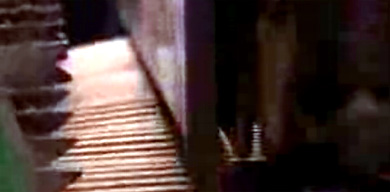
This screenshot has height=192, width=390. Find the location of `top of stair`. top of stair is located at coordinates (114, 85).